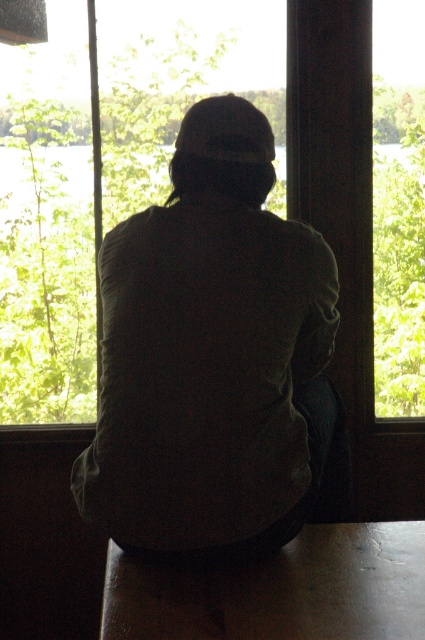
Who is positioned more to the left, dark green fabric at center or transparent glass window at center?

transparent glass window at center is more to the left.

Image resolution: width=425 pixels, height=640 pixels. Describe the element at coordinates (212, 355) in the screenshot. I see `dark green fabric at center` at that location.

Find the location of a particular element. The height and width of the screenshot is (640, 425). dark green fabric at center is located at coordinates point(212,355).